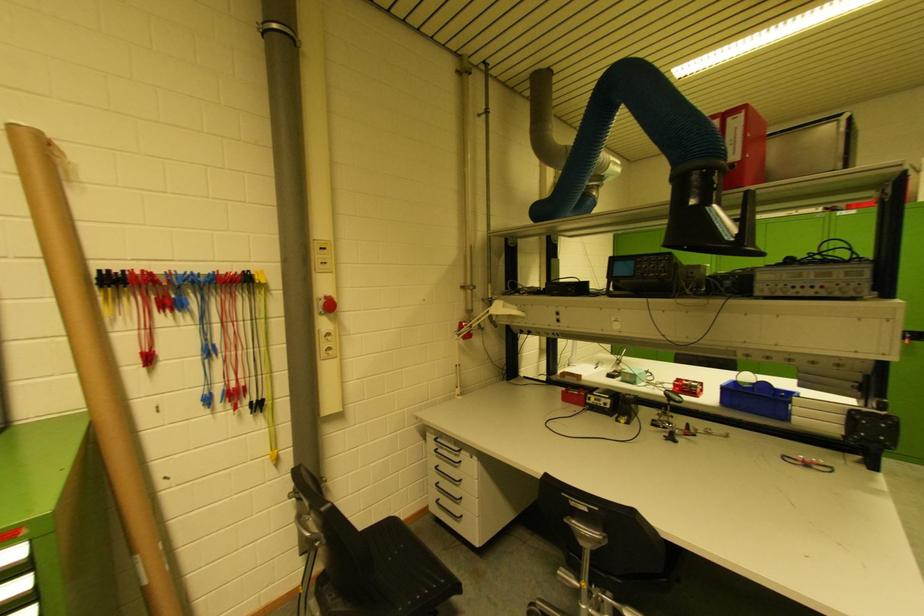
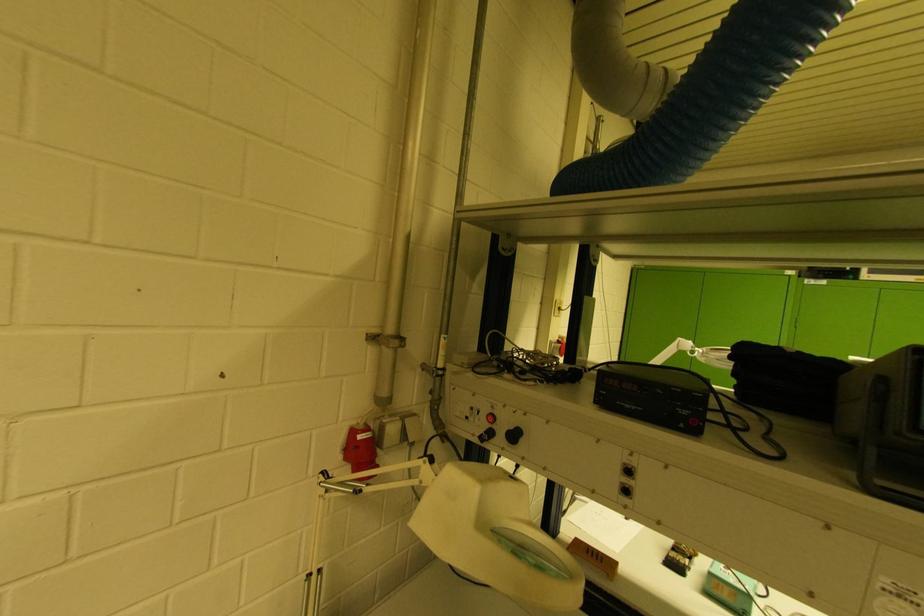
Question: In a continuous first-person perspective shot, in which direction is the camera moving?

Choices:
 (A) Left
 (B) Right
 (C) Forward
 (D) Backward

Answer: (C)